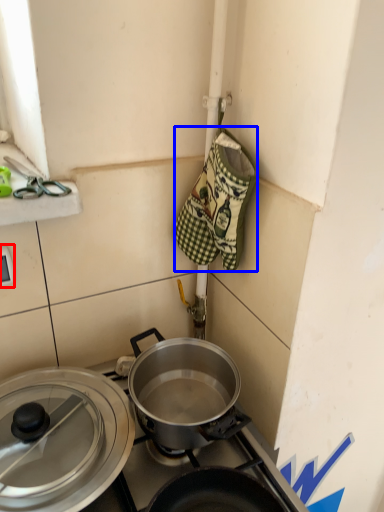
Question: Which point is further to the camera, electric outlet (highlighted by a red box) or material (highlighted by a blue box)?

Choices:
 (A) electric outlet
 (B) material

Answer: (A)